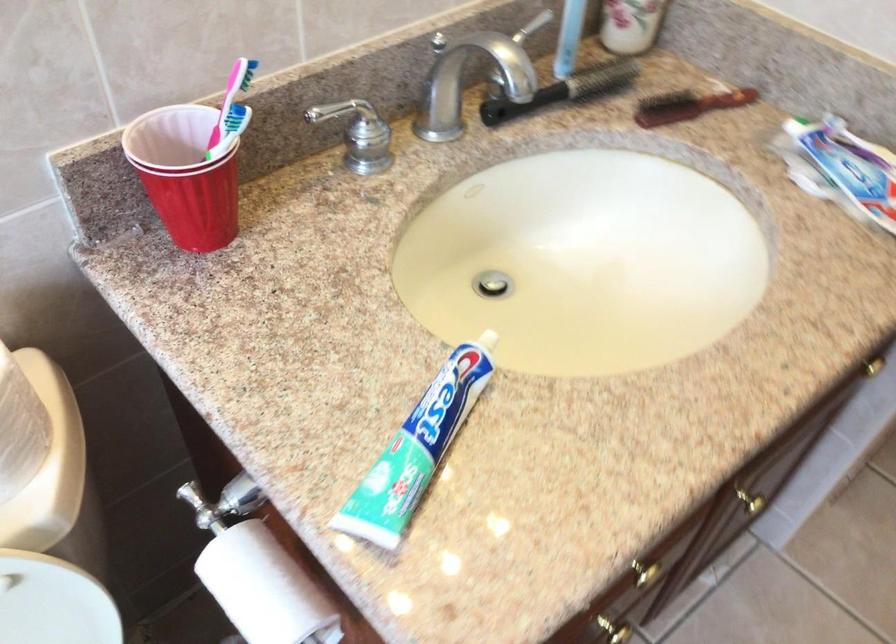
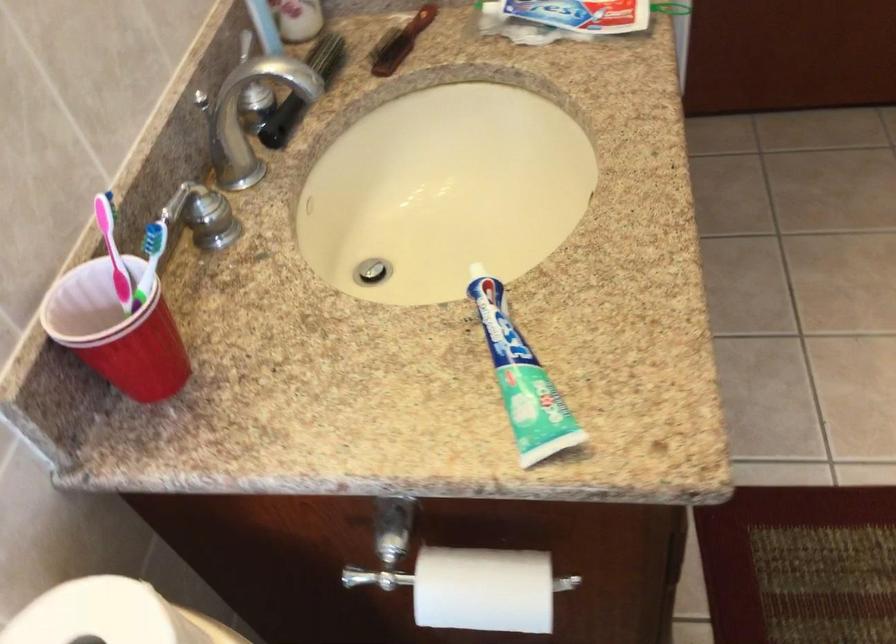
Question: The first image is from the beginning of the video and the second image is from the end. How did the camera likely rotate when shooting the video?

Choices:
 (A) Left
 (B) Right
 (C) Up
 (D) Down

Answer: (B)